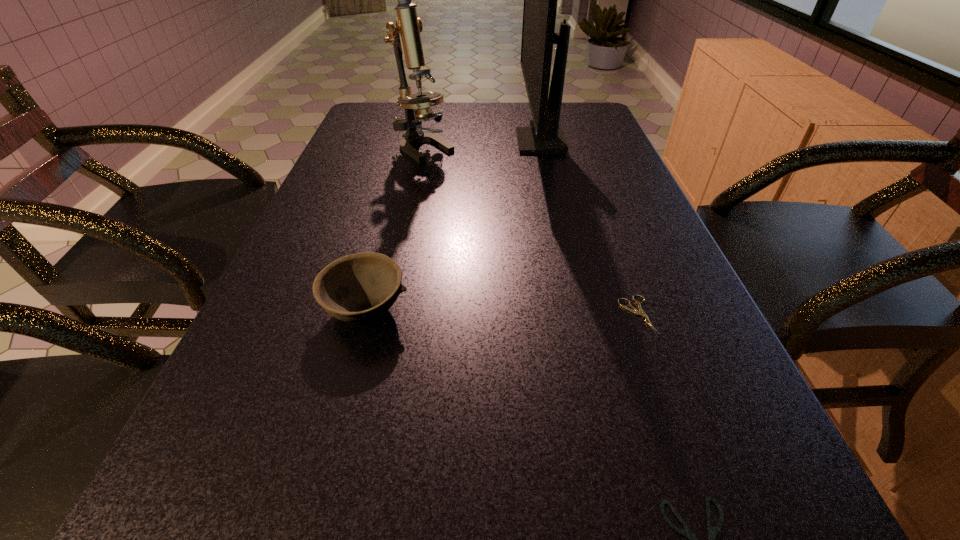
At what (x,y) coordinates should I click in order to perform the action: click on free location that satisfies the following two spatial constraints: 1. on the front-facing side of the computer monitor; 2. on the left side of the fourth tallest object. Please return your answer as a coordinate pair (x, y). This screenshot has width=960, height=540. Looking at the image, I should click on (580, 315).

This screenshot has height=540, width=960. Identify the location of vacant point that satisfies the following two spatial constraints: 1. on the front-facing side of the computer monitor; 2. on the back side of the taller shears. (580, 315).